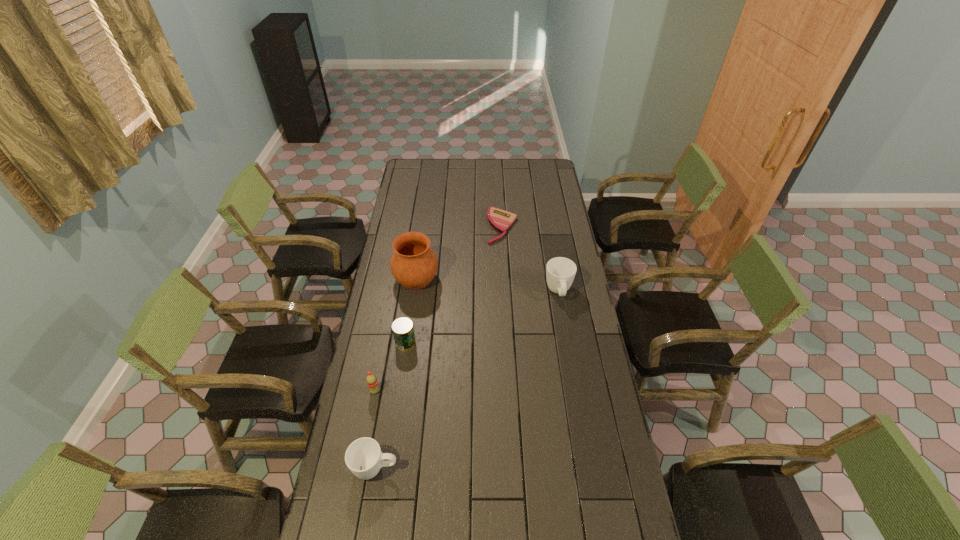
Identify the location of free space located 0.320m with the handle on the side of the right cup. (572, 371).

I want to click on free space located 0.210m on the right of the shortest object, so click(x=558, y=226).

This screenshot has height=540, width=960. In order to click on vacant region located on the right of the tallest object in this screenshot , I will do `click(461, 279)`.

The image size is (960, 540). I want to click on vacant space located on the front of the soda, so click(x=353, y=504).

Find the location of a particular element. The width and height of the screenshot is (960, 540). free space located on the back of the can is located at coordinates (411, 309).

Identify the location of cup that is at the left edge. The image size is (960, 540). (364, 458).

Locate an element on the screen. The image size is (960, 540). pottery located at the left edge is located at coordinates (414, 264).

This screenshot has width=960, height=540. I want to click on soda that is at the left edge, so click(x=371, y=380).

Find the location of `can that is at the left edge`. can that is at the left edge is located at coordinates (403, 331).

Identify the location of object located in the right edge section of the desktop. (560, 272).